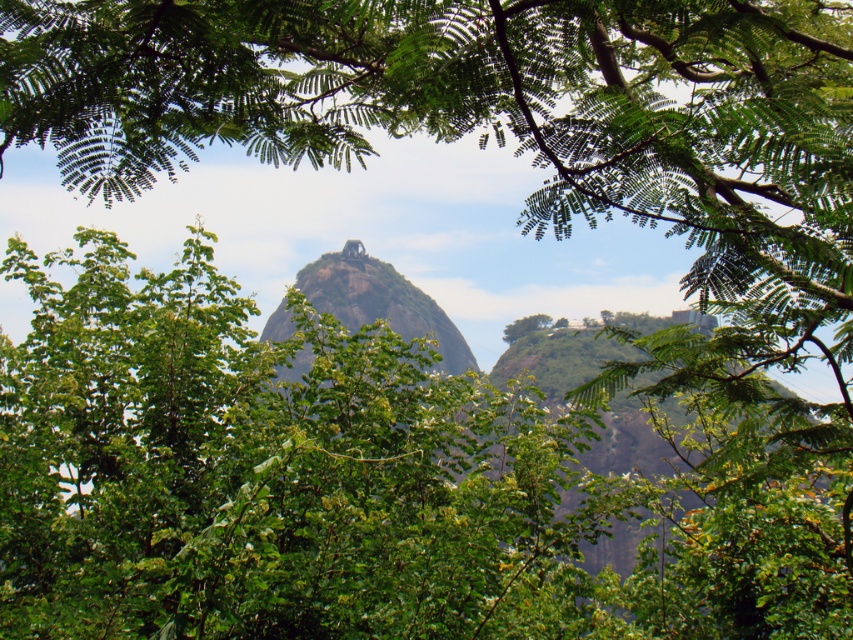
Question: Does green rock formation at center have a smaller size compared to green leafy tree at center?

Choices:
 (A) yes
 (B) no

Answer: (B)

Question: Is green rock formation at center positioned in front of green leafy tree at center?

Choices:
 (A) no
 (B) yes

Answer: (B)

Question: Which object is farther from the camera taking this photo?

Choices:
 (A) green rock formation at center
 (B) green leafy tree at center

Answer: (B)

Question: Does green rock formation at center appear on the right side of green leafy tree at center?

Choices:
 (A) yes
 (B) no

Answer: (B)

Question: Among these objects, which one is nearest to the camera?

Choices:
 (A) green rock formation at center
 (B) green leafy tree at center

Answer: (A)